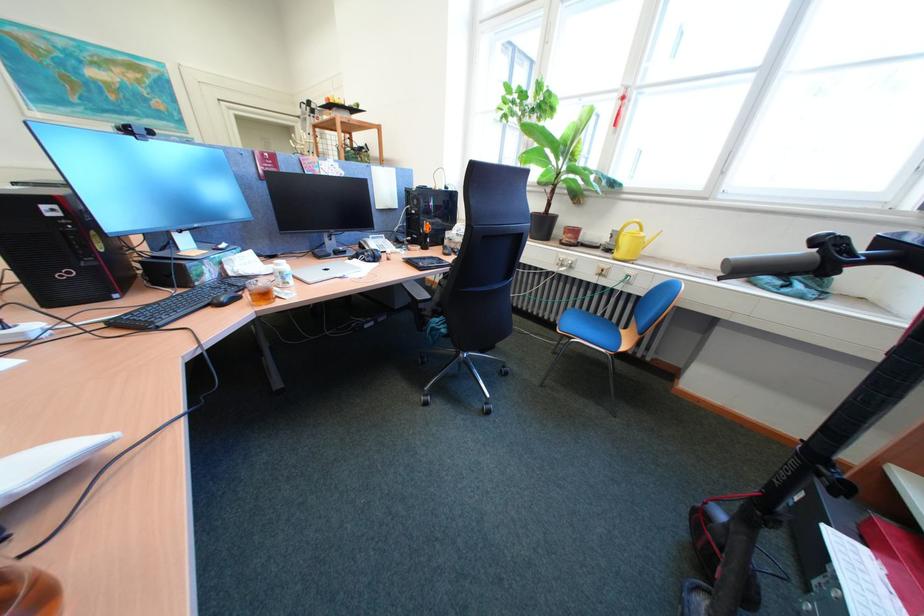
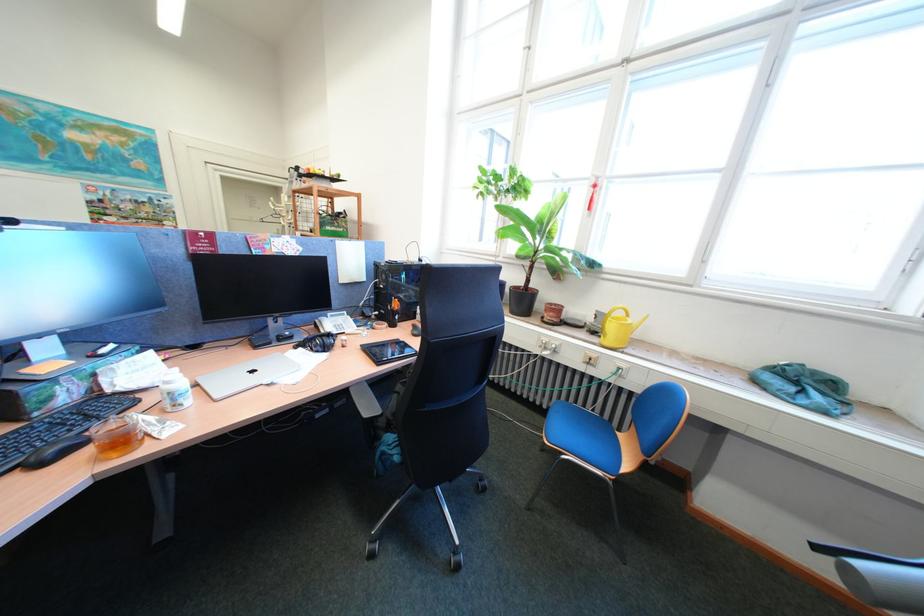
The point at (386, 240) is marked in the first image. Where is the corresponding point in the second image?

(345, 318)